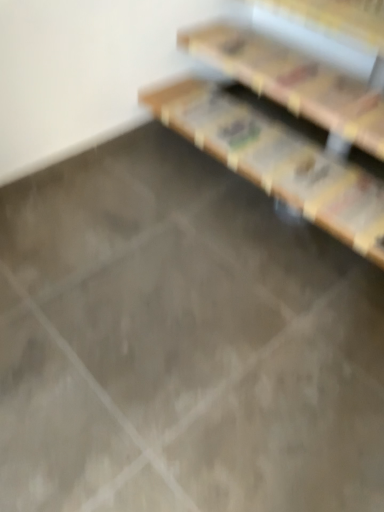
In order to face wooden bookshelf at upper right, should I rotate leftwards or rightwards?

A 10.034 degree turn to the right will do.

Measure the distance between point (322, 223) and camera.

Point (322, 223) is 1.44 meters from camera.

Find the location of a particular element. wooden bookshelf at upper right is located at coordinates (277, 162).

The image size is (384, 512). Describe the element at coordinates (277, 162) in the screenshot. I see `wooden bookshelf at upper right` at that location.

The width and height of the screenshot is (384, 512). What do you see at coordinates (293, 81) in the screenshot?
I see `wooden at upper right` at bounding box center [293, 81].

The height and width of the screenshot is (512, 384). Identify the location of wooden at upper right. (293, 81).

Measure the distance between point (324,101) and camera.

Point (324,101) is 4.91 feet from camera.

The image size is (384, 512). Find the location of `wooden bookshelf at upper right`. wooden bookshelf at upper right is located at coordinates (277, 162).

Which is more to the right, wooden at upper right or wooden bookshelf at upper right?

wooden at upper right is more to the right.

Does wooden at upper right come in front of wooden bookshelf at upper right?

No, it is behind wooden bookshelf at upper right.

Considering the positions of point (346, 138) and point (287, 198), is point (346, 138) closer or farther from the camera than point (287, 198)?

Point (346, 138).

From the image's perspective, relative to wooden bookshelf at upper right, is wooden at upper right above or below?

wooden at upper right is above wooden bookshelf at upper right.

From a real-world perspective, is wooden at upper right physically located above or below wooden bookshelf at upper right?

From a real-world perspective, wooden at upper right is physically above wooden bookshelf at upper right.

Which of these two, wooden at upper right or wooden bookshelf at upper right, is thinner?

wooden at upper right is thinner.

Which of these two, wooden at upper right or wooden bookshelf at upper right, stands taller?

With more height is wooden bookshelf at upper right.

From the picture: In terms of size, does wooden at upper right appear bigger or smaller than wooden bookshelf at upper right?

Considering their sizes, wooden at upper right takes up less space than wooden bookshelf at upper right.

Is wooden at upper right positioned beyond the bounds of wooden bookshelf at upper right?

That's correct, wooden at upper right is outside of wooden bookshelf at upper right.

Is wooden at upper right positioned far away from wooden bookshelf at upper right?

Actually, wooden at upper right and wooden bookshelf at upper right are a little close together.

Is wooden at upper right positioned with its back to wooden bookshelf at upper right?

No, wooden bookshelf at upper right is not at the back of wooden at upper right.

What's the angular difference between wooden at upper right and wooden bookshelf at upper right's facing directions?

The angular difference between wooden at upper right and wooden bookshelf at upper right is 0.0005 degrees.

At what (x,y) coordinates should I click in order to perform the action: click on furniture on the left of wooden at upper right. Please return your answer as a coordinate pair (x, y). The height and width of the screenshot is (512, 384). Looking at the image, I should click on pyautogui.click(x=277, y=162).

Between wooden bookshelf at upper right and wooden at upper right, which one appears on the left side from the viewer's perspective?

From the viewer's perspective, wooden bookshelf at upper right appears more on the left side.

Which object is closer to the camera, wooden bookshelf at upper right or wooden at upper right?

wooden bookshelf at upper right.

Which is closer to the camera, [359,224] or [337,91]?

Positioned in front is point [359,224].

From the image's perspective, which object appears higher, wooden bookshelf at upper right or wooden at upper right?

wooden at upper right.

From a real-world perspective, is wooden bookshelf at upper right under wooden at upper right?

Yes.

Based on the photo, is wooden bookshelf at upper right thinner than wooden at upper right?

In fact, wooden bookshelf at upper right might be wider than wooden at upper right.

Considering the relative sizes of wooden bookshelf at upper right and wooden at upper right in the image provided, is wooden bookshelf at upper right shorter than wooden at upper right?

No.

Considering the sizes of wooden bookshelf at upper right and wooden at upper right in the image, is wooden bookshelf at upper right bigger or smaller than wooden at upper right?

wooden bookshelf at upper right is bigger than wooden at upper right.

Is wooden bookshelf at upper right located outside wooden at upper right?

That's correct, wooden bookshelf at upper right is outside of wooden at upper right.

Consider the image. Is wooden bookshelf at upper right directly adjacent to wooden at upper right?

Yes.

Is wooden bookshelf at upper right positioned with its back to wooden at upper right?

wooden bookshelf at upper right does not have its back to wooden at upper right.

Measure the distance from wooden bookshelf at upper right to wooden at upper right.

wooden bookshelf at upper right is 2.97 inches from wooden at upper right.

At what (x,y) coordinates should I click in order to perform the action: click on furniture that appears below the wooden at upper right (from the image's perspective). Please return your answer as a coordinate pair (x, y). Image resolution: width=384 pixels, height=512 pixels. Looking at the image, I should click on (277, 162).

Identify the location of furniture that is in front of the wooden at upper right. [277, 162].

The height and width of the screenshot is (512, 384). In order to click on shelf behind the wooden bookshelf at upper right in this screenshot , I will do `click(293, 81)`.